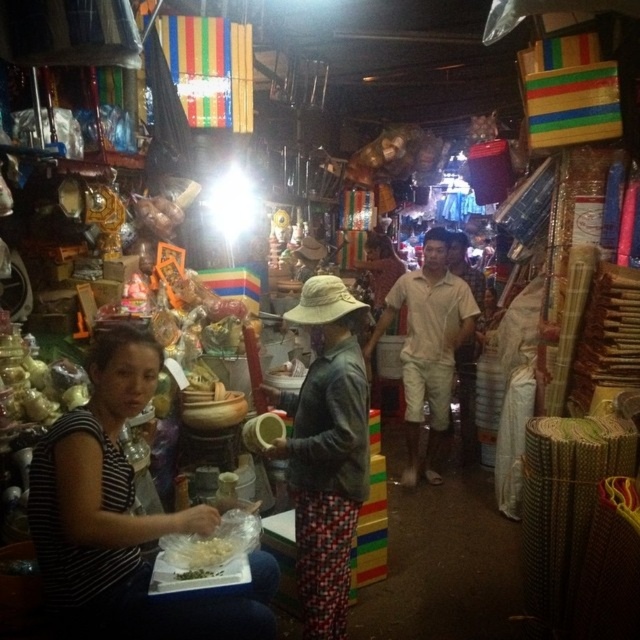
Question: Does light brown cotton shirt at center appear on the right side of white matte food at lower left?

Choices:
 (A) no
 (B) yes

Answer: (B)

Question: Does leather jacket at center appear on the left side of light brown cotton shirt at center?

Choices:
 (A) yes
 (B) no

Answer: (A)

Question: Which object is farther from the camera taking this photo?

Choices:
 (A) light brown cotton shirt at center
 (B) striped fabric shirt at lower left

Answer: (A)

Question: Considering the real-world distances, which object is farthest from the leather jacket at center?

Choices:
 (A) white matte food at lower left
 (B) striped fabric shirt at lower left

Answer: (B)

Question: Which object is farther from the camera taking this photo?

Choices:
 (A) striped fabric shirt at lower left
 (B) light brown cotton shirt at center
 (C) leather jacket at center
 (D) white matte food at lower left

Answer: (B)

Question: Does striped fabric shirt at lower left have a larger size compared to leather jacket at center?

Choices:
 (A) no
 (B) yes

Answer: (A)